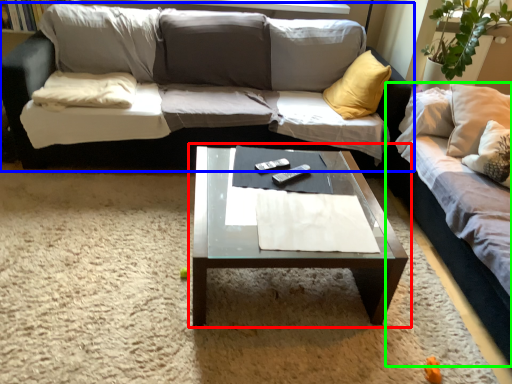
Question: Estimate the real-world distances between objects in this image. Which object is closer to coffee table (highlighted by a red box), studio couch (highlighted by a blue box) or studio couch (highlighted by a green box)?

Choices:
 (A) studio couch
 (B) studio couch

Answer: (B)